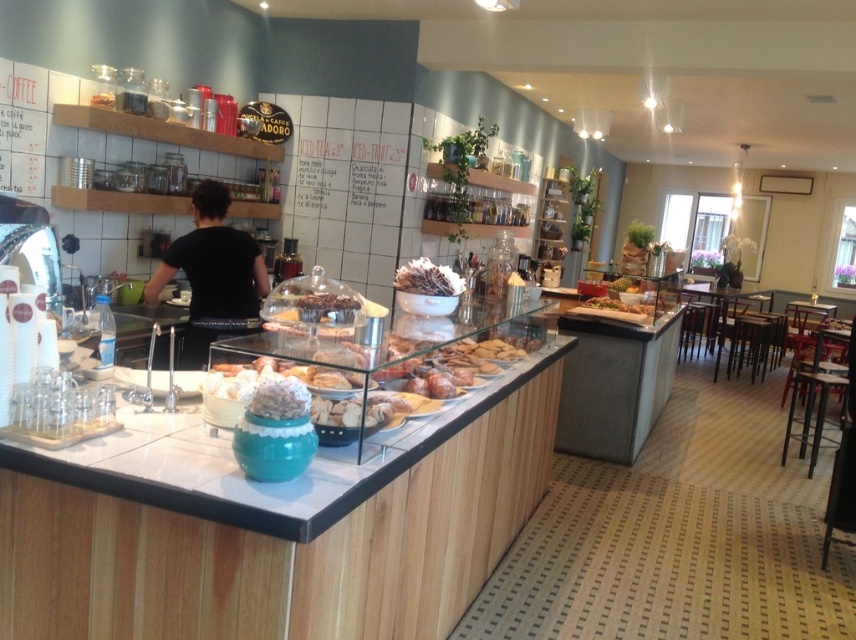
Is point (314, 529) less distant than point (437, 272)?

Yes.

The width and height of the screenshot is (856, 640). I want to click on wooden counter top at center, so click(x=241, y=472).

Does black fabric shirt at center have a greater height compared to chocolate-covered nuts at center?

Yes, black fabric shirt at center is taller than chocolate-covered nuts at center.

Which is in front, point (241, 273) or point (428, 288)?

Positioned in front is point (428, 288).

Where is `black fabric shirt at center`? black fabric shirt at center is located at coordinates (212, 275).

Which is more to the left, wooden counter top at center or black fabric shirt at center?

Positioned to the left is black fabric shirt at center.

Is point (290, 502) farther from camera compared to point (159, 275)?

No.

Find the location of a particular element. The width and height of the screenshot is (856, 640). wooden counter top at center is located at coordinates (241, 472).